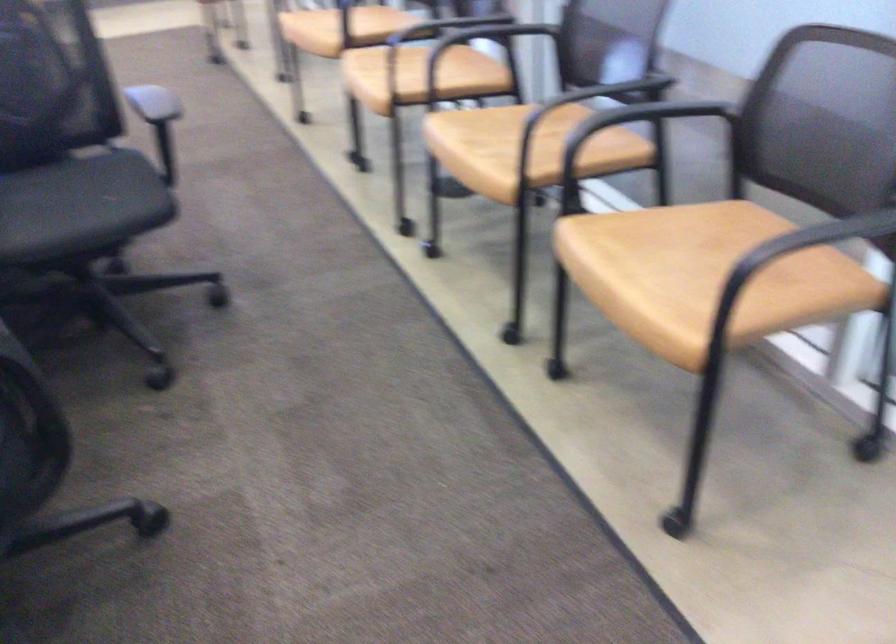
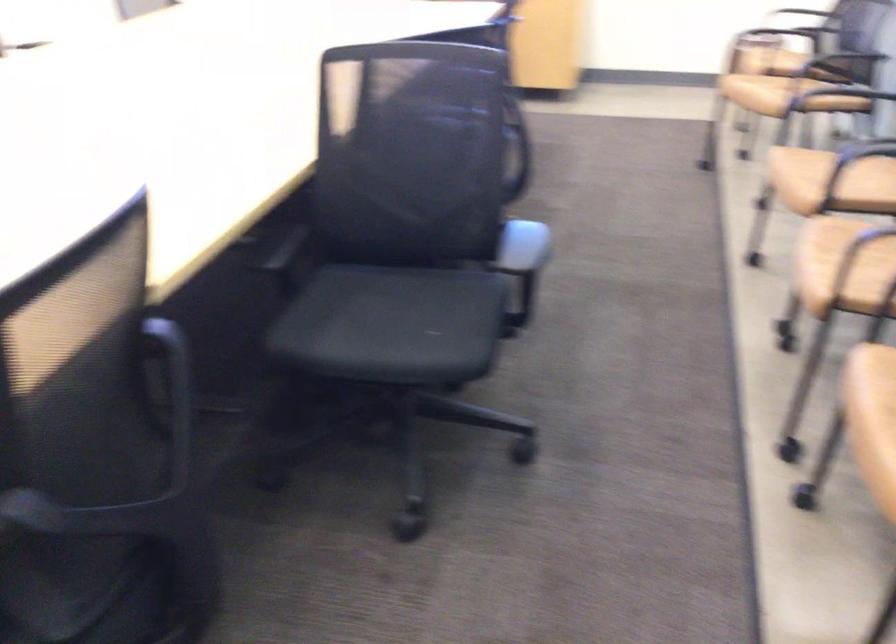
Question: The images are taken continuously from a first-person perspective. In which direction is your viewpoint rotating?

Choices:
 (A) Left
 (B) Right
 (C) Up
 (D) Down

Answer: (A)